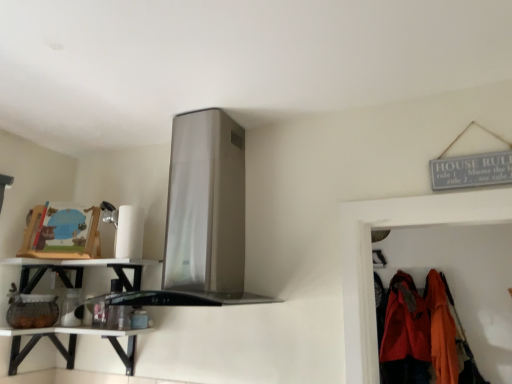
The image size is (512, 384). I want to click on empty space that is ontop of satin silver exhaust hood at upper center (from a real-world perspective), so click(x=200, y=108).